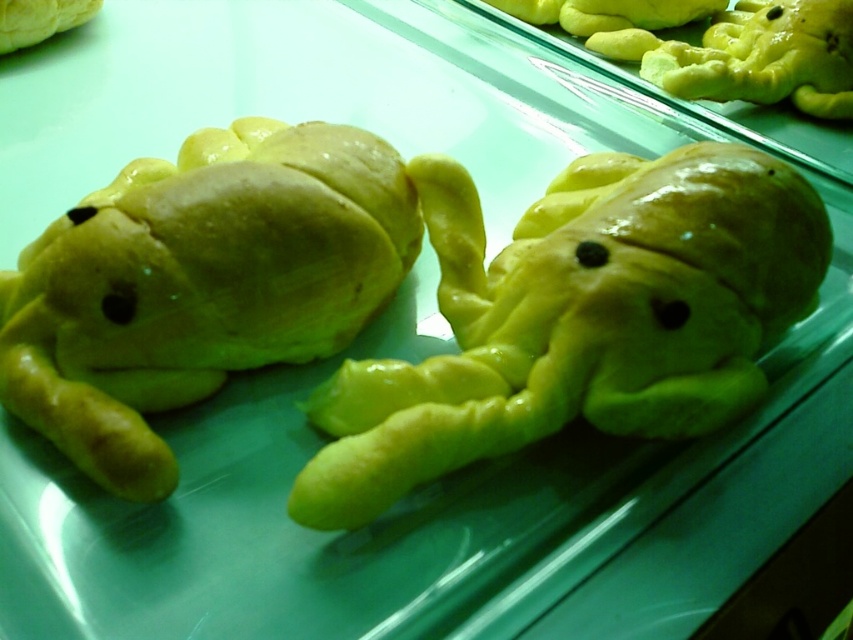
You are a customer at a bakery and want to take a photo of the two frog pastries. The first pastry is at point (x=676, y=182) and the second is at point (x=140, y=273). To ensure both are in focus, you need to know which pastry is closer to you. Which pastry is closer?

The pastry at point (x=140, y=273) is closer to you because point (x=676, y=182) is further away according to the description.

You are a baker arranging pastries on a display. You have a yellow matte dough at center and a yellow matte frog at left. Which pastry is positioned lower on the display?

Result: The yellow matte dough at center is positioned lower than the yellow matte frog at left because it is below it.

You are a baker who needs to arrange these pastries on a shelf. The shelf has a height limit of 10 cm. You have the yellow matte dough at center and the yellow matte frog at left. Based on their heights, which pastry can safely be placed on the shelf without exceeding the height limit?

The yellow matte dough at center is not as tall as the yellow matte frog at left. Since the shelf has a 10 cm height limit, the yellow matte dough at center can be safely placed on the shelf, but the yellow matte frog at left might exceed the height limit and should be checked first.